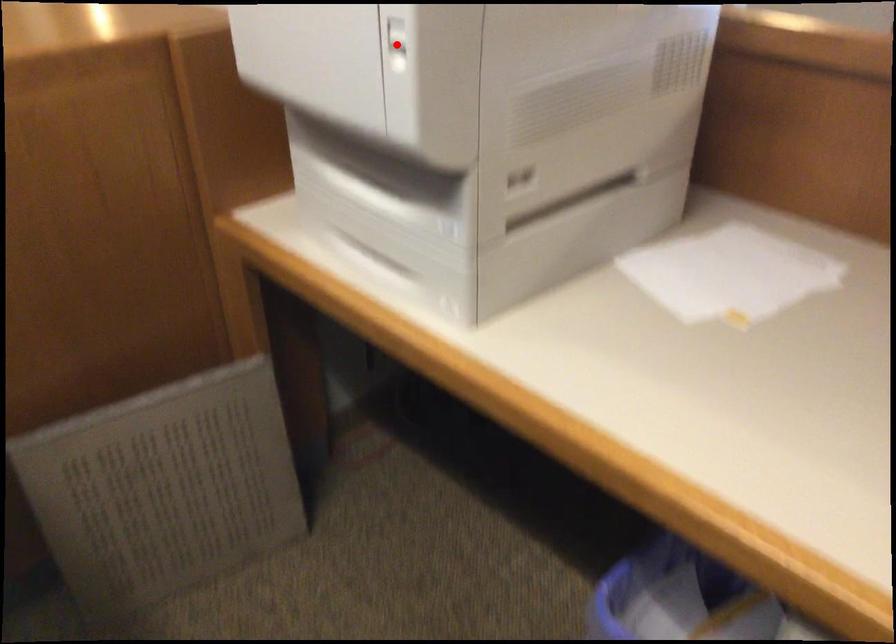
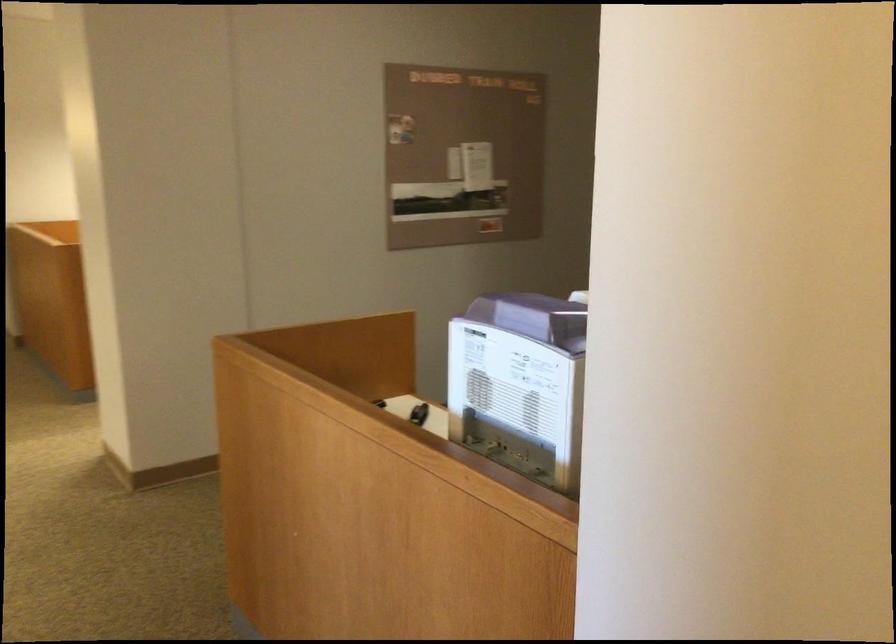
Question: I am providing you with two images of the same scene from different viewpoints. A red point is marked on the first image. At the location where the point appears in image 1, is it still visible in image 2?

Choices:
 (A) Yes
 (B) No

Answer: (B)